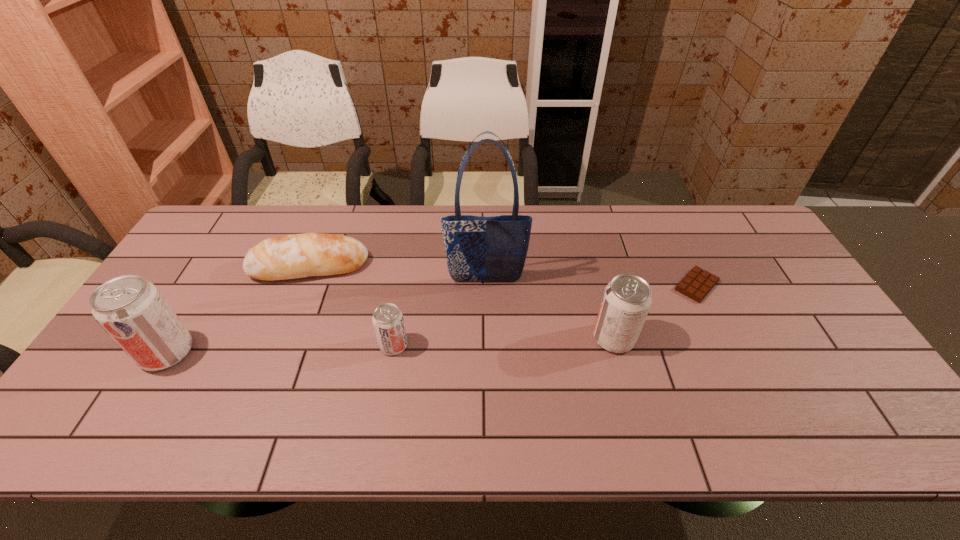
Where is `shopping bag`? This screenshot has height=540, width=960. shopping bag is located at coordinates click(x=478, y=248).

Locate an element on the screen. The height and width of the screenshot is (540, 960). vacant space located on the back of the leftmost object is located at coordinates (217, 270).

Where is `vacant area situated 0.330m on the left of the fourth object from right to left`? This screenshot has height=540, width=960. vacant area situated 0.330m on the left of the fourth object from right to left is located at coordinates (253, 345).

Where is `blank space located 0.250m on the left of the fifth object from left to right`? Image resolution: width=960 pixels, height=540 pixels. blank space located 0.250m on the left of the fifth object from left to right is located at coordinates (498, 338).

This screenshot has height=540, width=960. I want to click on free space located on the back of the bread, so click(x=328, y=219).

This screenshot has width=960, height=540. In order to click on free point located 0.300m on the left of the rightmost object in this screenshot , I will do `click(571, 286)`.

Where is `vacant space located on the front-facing side of the tallest object`? vacant space located on the front-facing side of the tallest object is located at coordinates (487, 323).

Identify the location of object positioned at the far edge. (293, 256).

The width and height of the screenshot is (960, 540). Find the location of `object at the near edge`. object at the near edge is located at coordinates (135, 314).

Where is `object that is at the left edge`? This screenshot has width=960, height=540. object that is at the left edge is located at coordinates (135, 314).